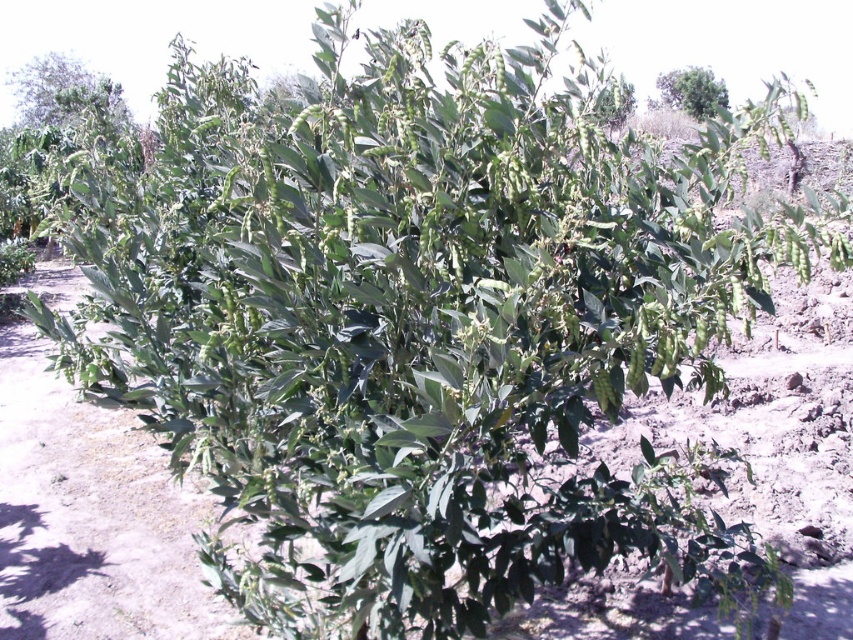
You are a farmer inspecting crops and notice the green leafy plant at upper left and the green leafy tree at upper center. Which one takes up more space in the image?

The green leafy tree at upper center takes up more space than the green leafy plant at upper left.

In the scene shown: You are a farmer inspecting crops and see the green leafy plant at upper left and the green leafy tree at upper center. Which one is positioned higher in the image?

The green leafy plant at upper left is positioned higher in the image than the green leafy tree at upper center.